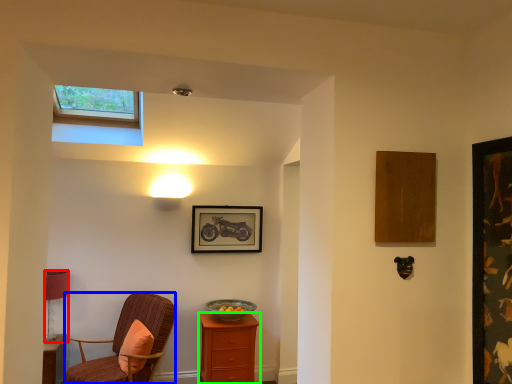
Question: Considering the real-world distances, which object is farthest from lamp (highlighted by a red box)? chair (highlighted by a blue box) or nightstand (highlighted by a green box)?

Choices:
 (A) chair
 (B) nightstand

Answer: (B)